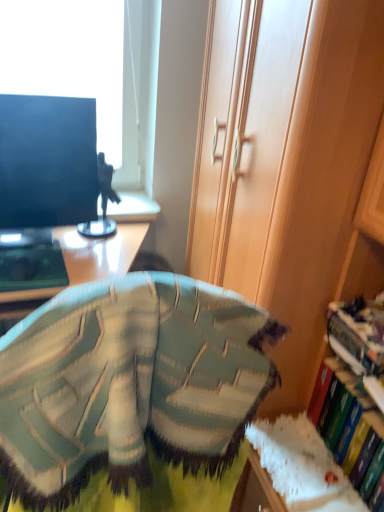
Question: Can you confirm if hardcover book at right, the second book when ordered from top to bottom, is shorter than green knitted bean bag chair at center?

Choices:
 (A) yes
 (B) no

Answer: (A)

Question: Does hardcover book at right, which is the 1th book in bottom-to-top order, appear on the right side of green knitted bean bag chair at center?

Choices:
 (A) yes
 (B) no

Answer: (A)

Question: Is hardcover book at right, which is the 1th book in bottom-to-top order, not within green knitted bean bag chair at center?

Choices:
 (A) no
 (B) yes

Answer: (B)

Question: Is hardcover book at right, which is the 1th book in bottom-to-top order, thinner than green knitted bean bag chair at center?

Choices:
 (A) no
 (B) yes

Answer: (B)

Question: Can green knitted bean bag chair at center be found inside hardcover book at right, the second book when ordered from top to bottom?

Choices:
 (A) no
 (B) yes

Answer: (A)

Question: From a real-world perspective, is green knitted bean bag chair at center above or below wooden cabinet at right?

Choices:
 (A) below
 (B) above

Answer: (B)

Question: Based on their positions, is green knitted bean bag chair at center located to the left or right of wooden cabinet at right?

Choices:
 (A) right
 (B) left

Answer: (B)

Question: Is green knitted bean bag chair at center wider or thinner than wooden cabinet at right?

Choices:
 (A) thin
 (B) wide

Answer: (A)

Question: From the image's perspective, relative to wooden cabinet at right, is green knitted bean bag chair at center above or below?

Choices:
 (A) below
 (B) above

Answer: (A)

Question: From their relative heights in the image, would you say hardcover book at right, which is the 1th book in bottom-to-top order, is taller or shorter than green knitted bean bag chair at center?

Choices:
 (A) short
 (B) tall

Answer: (A)

Question: Considering their positions, is hardcover book at right, the second book when ordered from top to bottom, located in front of or behind green knitted bean bag chair at center?

Choices:
 (A) behind
 (B) front

Answer: (A)

Question: Which is correct: hardcover book at right, the second book when ordered from top to bottom, is inside green knitted bean bag chair at center, or outside of it?

Choices:
 (A) inside
 (B) outside

Answer: (B)

Question: From a real-world perspective, is hardcover book at right, the second book when ordered from top to bottom, physically located above or below green knitted bean bag chair at center?

Choices:
 (A) below
 (B) above

Answer: (A)

Question: Is hardcover book at right, the second book when ordered from top to bottom, in front of or behind matte black monitor at left in the image?

Choices:
 (A) front
 (B) behind

Answer: (A)

Question: Is hardcover book at right, the second book when ordered from top to bottom, inside or outside of matte black monitor at left?

Choices:
 (A) inside
 (B) outside

Answer: (B)